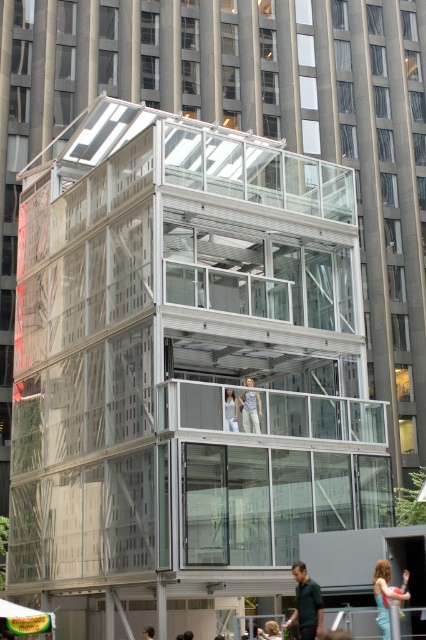
Is transparent glass building at center closer to the viewer compared to light brown leather jacket at center?

No, it is not.

From the picture: Is transparent glass building at center above light brown leather jacket at center?

Correct, transparent glass building at center is located above light brown leather jacket at center.

Locate an element on the screen. Image resolution: width=426 pixels, height=640 pixels. transparent glass building at center is located at coordinates (181, 344).

Where is `transparent glass building at center`? transparent glass building at center is located at coordinates click(x=181, y=344).

Who is positioned more to the right, light brown hair at center or smooth skin person at center?

From the viewer's perspective, light brown hair at center appears more on the right side.

Between point (408, 598) and point (192, 632), which one is positioned in front?

Point (408, 598) is more forward.

Between point (385, 634) and point (189, 632), which one is positioned in front?

Point (385, 634) is more forward.

At what (x,y) coordinates should I click in order to perform the action: click on light brown hair at center. Please return your answer as a coordinate pair (x, y). Image resolution: width=426 pixels, height=640 pixels. Looking at the image, I should click on (386, 595).

Does dark green shirt at center appear on the right side of light beige fabric pants at center?

Indeed, dark green shirt at center is positioned on the right side of light beige fabric pants at center.

Based on the photo, who is positioned more to the left, dark green shirt at center or light beige fabric pants at center?

Positioned to the left is light beige fabric pants at center.

Is point (321, 602) more distant than point (236, 420)?

No.

Locate an element on the screen. This screenshot has height=640, width=426. dark green shirt at center is located at coordinates [305, 604].